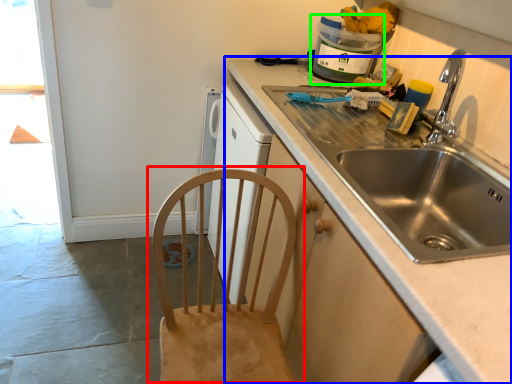
Question: Based on their relative distances, which object is farther from chair (highlighted by a red box)? Choose from countertop (highlighted by a blue box) and appliance (highlighted by a green box).

Choices:
 (A) countertop
 (B) appliance

Answer: (B)